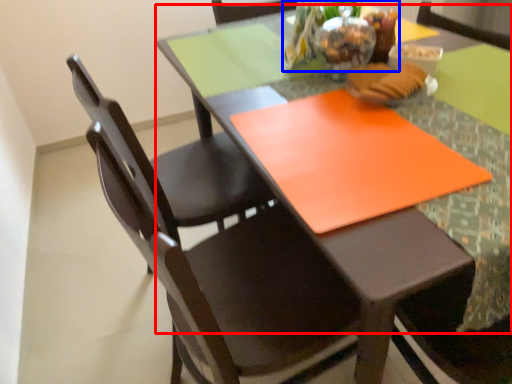
Question: Which of the following is the closest to the observer, round table (highlighted by a red box) or floral arrangement (highlighted by a blue box)?

Choices:
 (A) round table
 (B) floral arrangement

Answer: (A)